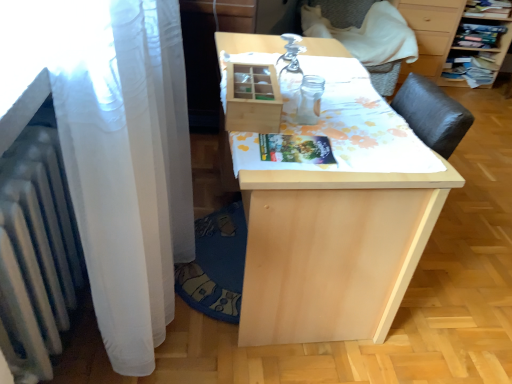
Question: Is natural wood table at center located outside wooden drawer at upper right?

Choices:
 (A) no
 (B) yes

Answer: (B)

Question: Can you confirm if natural wood table at center is bigger than wooden drawer at upper right?

Choices:
 (A) no
 (B) yes

Answer: (B)

Question: Is natural wood table at center far away from wooden drawer at upper right?

Choices:
 (A) yes
 (B) no

Answer: (A)

Question: From the image's perspective, would you say natural wood table at center is shown under wooden drawer at upper right?

Choices:
 (A) no
 (B) yes

Answer: (B)

Question: Is natural wood table at center smaller than wooden drawer at upper right?

Choices:
 (A) yes
 (B) no

Answer: (B)

Question: Considering the positions of point (12, 215) and point (284, 339), is point (12, 215) closer or farther from the camera than point (284, 339)?

Choices:
 (A) closer
 (B) farther

Answer: (A)

Question: Considering the relative positions of white metallic radiator at left and natural wood table at center in the image provided, is white metallic radiator at left to the left or to the right of natural wood table at center?

Choices:
 (A) right
 (B) left

Answer: (B)

Question: In the image, is white metallic radiator at left positioned in front of or behind natural wood table at center?

Choices:
 (A) front
 (B) behind

Answer: (A)

Question: From the image's perspective, is white metallic radiator at left located above or below natural wood table at center?

Choices:
 (A) above
 (B) below

Answer: (B)

Question: From the image's perspective, is wooden drawer at upper right above or below white metallic radiator at left?

Choices:
 (A) above
 (B) below

Answer: (A)

Question: Looking at their shapes, would you say wooden drawer at upper right is wider or thinner than white metallic radiator at left?

Choices:
 (A) thin
 (B) wide

Answer: (B)

Question: Considering the positions of wooden drawer at upper right and white metallic radiator at left in the image, is wooden drawer at upper right bigger or smaller than white metallic radiator at left?

Choices:
 (A) big
 (B) small

Answer: (A)

Question: Is point (448, 49) closer or farther from the camera than point (30, 307)?

Choices:
 (A) closer
 (B) farther

Answer: (B)

Question: In terms of size, does wooden drawer at upper right appear bigger or smaller than natural wood table at center?

Choices:
 (A) big
 (B) small

Answer: (B)

Question: In terms of width, does wooden drawer at upper right look wider or thinner when compared to natural wood table at center?

Choices:
 (A) wide
 (B) thin

Answer: (B)